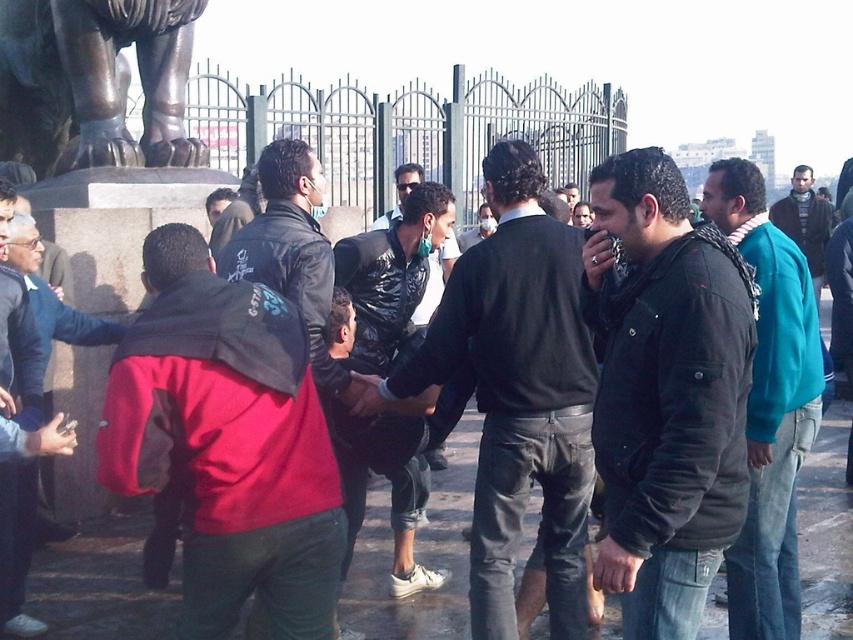
Is point (76, 90) behind point (428, 412)?

Yes.

Does bronze statue at upper left appear under shiny black jacket at center?

No.

Between point (10, 144) and point (416, 264), which one is positioned behind?

Point (10, 144)

This screenshot has width=853, height=640. I want to click on bronze statue at upper left, so (94, 83).

Is red matte jacket at center taller than bronze statue at upper left?

Yes.

What do you see at coordinates (227, 442) in the screenshot?
I see `red matte jacket at center` at bounding box center [227, 442].

The width and height of the screenshot is (853, 640). I want to click on red matte jacket at center, so (x=227, y=442).

Based on the photo, how distant is teal fleece jacket at right from shiny black jacket at center?

They are 8.24 meters apart.

Who is higher up, teal fleece jacket at right or shiny black jacket at center?

Positioned higher is teal fleece jacket at right.

Does point (788, 609) come in front of point (397, 368)?

Yes, point (788, 609) is closer to viewer.

This screenshot has height=640, width=853. In order to click on teal fleece jacket at right in this screenshot , I will do `click(769, 404)`.